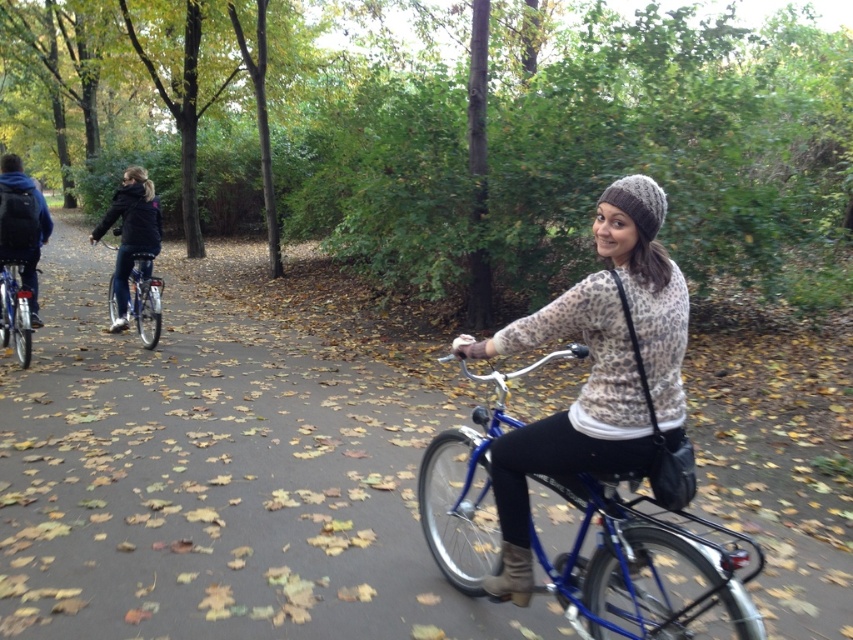
Question: Which of the following is the closest to the observer?

Choices:
 (A) shiny silver bicycle at left
 (B) shiny metallic bicycle at left
 (C) blue backpack at left

Answer: (B)

Question: Which of these objects is positioned closest to the shiny silver bicycle at left?

Choices:
 (A) blue metallic bicycle at center
 (B) shiny metallic bicycle at left
 (C) blue backpack at left
 (D) leopard print sweater at center

Answer: (B)

Question: Can you confirm if leopard print sweater at center is smaller than shiny silver bicycle at left?

Choices:
 (A) yes
 (B) no

Answer: (B)

Question: Does leopard print sweater at center have a smaller size compared to blue backpack at left?

Choices:
 (A) no
 (B) yes

Answer: (B)

Question: Which point is farther to the camera?

Choices:
 (A) pos(16,211)
 (B) pos(114,284)
 (C) pos(672,625)

Answer: (B)

Question: Is leopard print sweater at center to the right of blue metallic bicycle at center from the viewer's perspective?

Choices:
 (A) yes
 (B) no

Answer: (B)